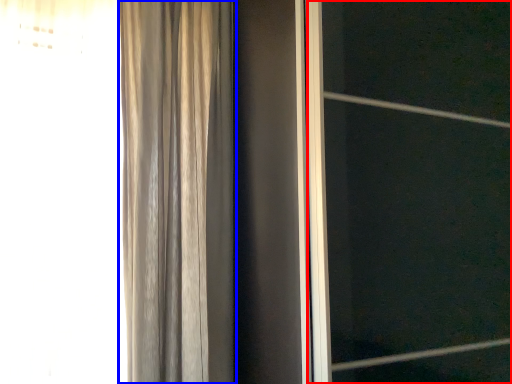
Question: Which object is closer to the camera taking this photo, screen door (highlighted by a red box) or curtain (highlighted by a blue box)?

Choices:
 (A) screen door
 (B) curtain

Answer: (A)